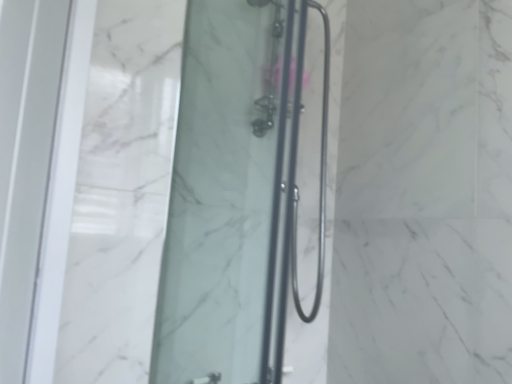
Question: Which direction should I rotate to look at transparent glass shower door at center, positioned as the second shower door in back-to-front order, — up or down?

Choices:
 (A) down
 (B) up

Answer: (B)

Question: Is black metal shower door at center, the 1th shower door when ordered from right to left, positioned behind transparent glass shower door at center, which is counted as the first shower door, starting from the left?

Choices:
 (A) yes
 (B) no

Answer: (A)

Question: From the image's perspective, is black metal shower door at center, the 2th shower door when ordered from front to back, located beneath transparent glass shower door at center, the first shower door viewed from the front?

Choices:
 (A) yes
 (B) no

Answer: (B)

Question: Is black metal shower door at center, the 2th shower door when ordered from front to back, thinner than transparent glass shower door at center, positioned as the second shower door in back-to-front order?

Choices:
 (A) no
 (B) yes

Answer: (A)

Question: Does black metal shower door at center, the 2th shower door positioned from the left, come in front of transparent glass shower door at center, the first shower door viewed from the front?

Choices:
 (A) no
 (B) yes

Answer: (A)

Question: Is transparent glass shower door at center, which appears as the 2th shower door when viewed from the right, at the back of black metal shower door at center, the 2th shower door when ordered from front to back?

Choices:
 (A) no
 (B) yes

Answer: (A)

Question: Considering the relative sizes of black metal shower door at center, the 2th shower door positioned from the left, and transparent glass shower door at center, positioned as the second shower door in back-to-front order, in the image provided, is black metal shower door at center, the 2th shower door positioned from the left, bigger than transparent glass shower door at center, positioned as the second shower door in back-to-front order,?

Choices:
 (A) no
 (B) yes

Answer: (A)

Question: Is transparent glass shower door at center, the first shower door viewed from the front, positioned behind black metal shower door at center, the 1th shower door when ordered from right to left?

Choices:
 (A) yes
 (B) no

Answer: (B)

Question: From a real-world perspective, is transparent glass shower door at center, which is counted as the first shower door, starting from the left, below black metal shower door at center, the 1th shower door when ordered from right to left?

Choices:
 (A) no
 (B) yes

Answer: (B)

Question: Is transparent glass shower door at center, which appears as the 2th shower door when viewed from the right, shorter than black metal shower door at center, the 2th shower door positioned from the left?

Choices:
 (A) yes
 (B) no

Answer: (B)

Question: Considering the relative positions of transparent glass shower door at center, which appears as the 2th shower door when viewed from the right, and black metal shower door at center, the 2th shower door positioned from the left, in the image provided, is transparent glass shower door at center, which appears as the 2th shower door when viewed from the right, in front of black metal shower door at center, the 2th shower door positioned from the left,?

Choices:
 (A) yes
 (B) no

Answer: (A)

Question: Is the surface of transparent glass shower door at center, which is counted as the first shower door, starting from the left, in direct contact with black metal shower door at center, the first shower door when ordered from back to front?

Choices:
 (A) no
 (B) yes

Answer: (A)

Question: Can you confirm if transparent glass shower door at center, positioned as the second shower door in back-to-front order, is positioned to the right of black metal shower door at center, the first shower door when ordered from back to front?

Choices:
 (A) yes
 (B) no

Answer: (B)

Question: Is black metal shower door at center, the 1th shower door when ordered from right to left, situated inside transparent glass shower door at center, the first shower door viewed from the front, or outside?

Choices:
 (A) inside
 (B) outside

Answer: (B)